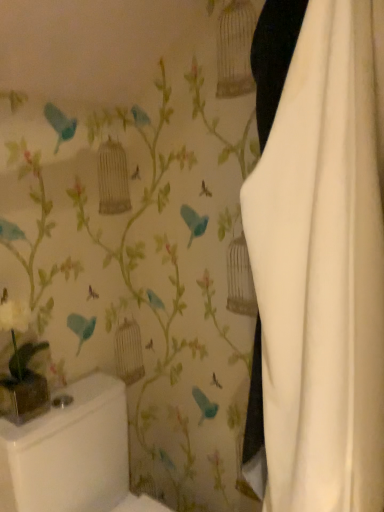
Question: From a real-world perspective, is white glossy toilet bowl at lower left located higher than white fabric curtain at right?

Choices:
 (A) yes
 (B) no

Answer: (B)

Question: Considering the relative sizes of white glossy toilet bowl at lower left and white fabric curtain at right in the image provided, is white glossy toilet bowl at lower left shorter than white fabric curtain at right?

Choices:
 (A) no
 (B) yes

Answer: (B)

Question: Is white fabric curtain at right a part of white glossy toilet bowl at lower left?

Choices:
 (A) no
 (B) yes

Answer: (A)

Question: Is white glossy toilet bowl at lower left at the right side of white fabric curtain at right?

Choices:
 (A) no
 (B) yes

Answer: (A)

Question: Is white glossy toilet bowl at lower left outside white fabric curtain at right?

Choices:
 (A) yes
 (B) no

Answer: (A)

Question: Is white glossy toilet bowl at lower left oriented towards white fabric curtain at right?

Choices:
 (A) no
 (B) yes

Answer: (B)

Question: Would you say white glossy toilet bowl at lower left is part of white fabric curtain at right's contents?

Choices:
 (A) yes
 (B) no

Answer: (B)

Question: Considering the relative sizes of white fabric curtain at right and white glossy toilet bowl at lower left in the image provided, is white fabric curtain at right wider than white glossy toilet bowl at lower left?

Choices:
 (A) no
 (B) yes

Answer: (A)

Question: Would you say white fabric curtain at right is a long distance from white glossy toilet bowl at lower left?

Choices:
 (A) yes
 (B) no

Answer: (B)

Question: Considering the relative sizes of white fabric curtain at right and white glossy toilet bowl at lower left in the image provided, is white fabric curtain at right bigger than white glossy toilet bowl at lower left?

Choices:
 (A) yes
 (B) no

Answer: (B)

Question: Considering the relative sizes of white fabric curtain at right and white glossy toilet bowl at lower left in the image provided, is white fabric curtain at right thinner than white glossy toilet bowl at lower left?

Choices:
 (A) no
 (B) yes

Answer: (B)

Question: From the image's perspective, would you say white fabric curtain at right is positioned over white glossy toilet bowl at lower left?

Choices:
 (A) no
 (B) yes

Answer: (B)

Question: Is white fabric curtain at right taller or shorter than white glossy toilet bowl at lower left?

Choices:
 (A) short
 (B) tall

Answer: (B)